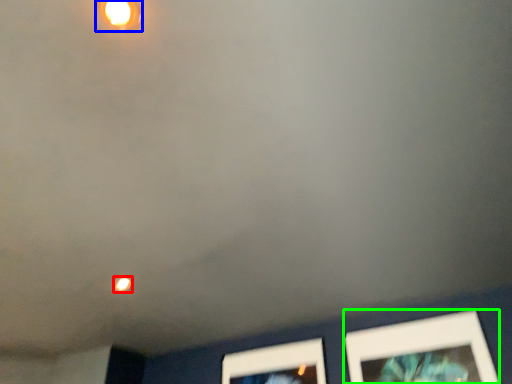
Question: Which object is the closest to the light (highlighted by a red box)? Choose among these: light fixture (highlighted by a blue box) or picture frame (highlighted by a green box).

Choices:
 (A) light fixture
 (B) picture frame

Answer: (A)